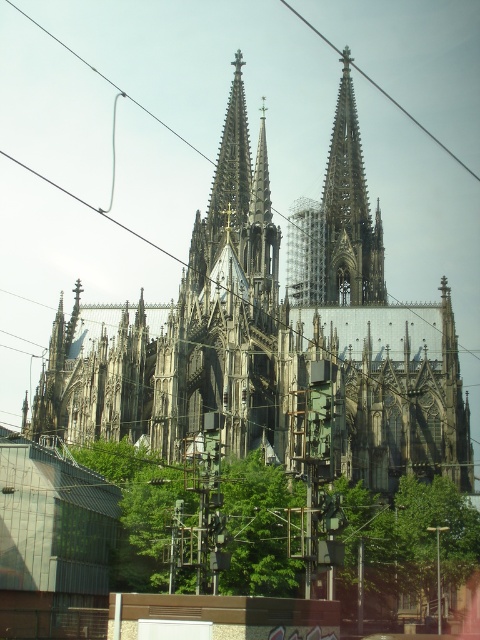
Is gray stone spire at center to the right of metallic wire at upper center from the viewer's perspective?

In fact, gray stone spire at center is to the left of metallic wire at upper center.

At what (x,y) coordinates should I click in order to perform the action: click on gray stone spire at center. Please return your answer as a coordinate pair (x, y). This screenshot has width=480, height=640. Looking at the image, I should click on (337, 221).

This screenshot has height=640, width=480. Find the location of `gray stone spire at center`. gray stone spire at center is located at coordinates (337, 221).

Does dark gray stone church at center lie in front of metallic wire at upper center?

Yes.

Is point (259, 172) positioned behind point (471, 172)?

No, it is in front of (471, 172).

Find the location of a particular element. The height and width of the screenshot is (640, 480). dark gray stone church at center is located at coordinates (272, 336).

Who is higher up, dark gray stone church at center or gray stone spire at center?

gray stone spire at center is higher up.

Which is in front, point (455, 348) or point (339, 182)?

Point (455, 348)

From the picture: Who is more distant from viewer, (238, 237) or (347, 241)?

Point (347, 241)

The image size is (480, 640). Identify the location of dark gray stone church at center. (272, 336).